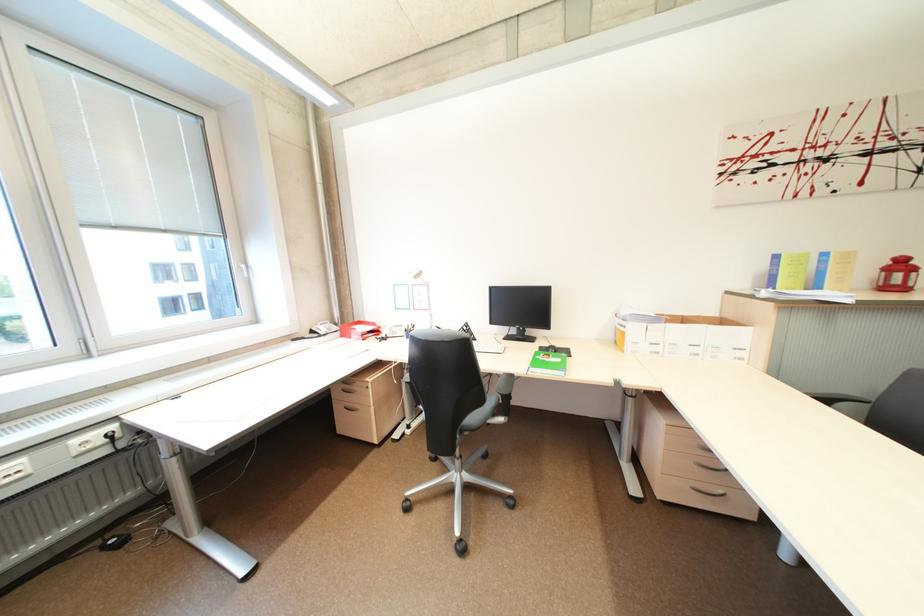
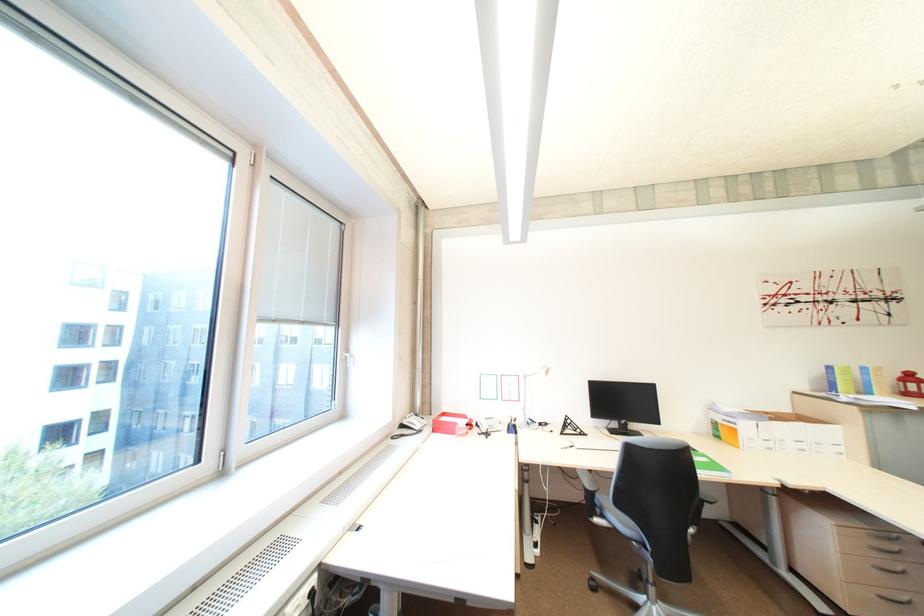
In the second image, find the point that corresponds to point (633, 334) in the first image.

(745, 431)